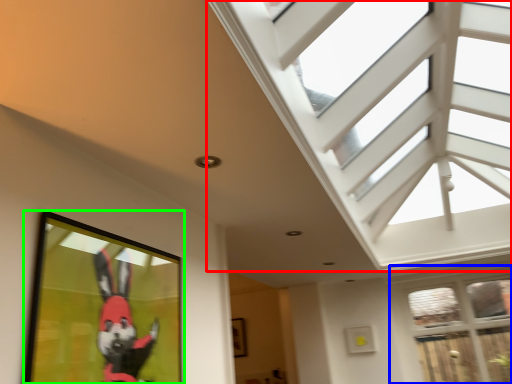
Question: Which is farther away from window (highlighted by a red box)? window (highlighted by a blue box) or picture frame (highlighted by a green box)?

Choices:
 (A) window
 (B) picture frame

Answer: (B)